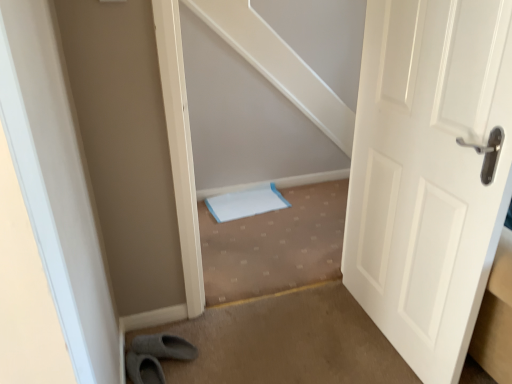
The height and width of the screenshot is (384, 512). I want to click on vacant space situated on the left part of white matte door at right, so click(x=315, y=340).